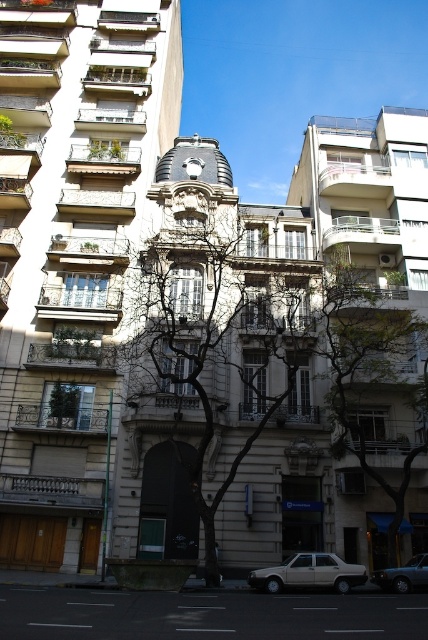
You are a delivery person who needs to park your beige matte sedan at lower center and a silver metallic sedan at center in a parking lot with limited space. Which car should you park first to maximize space efficiency?

The beige matte sedan at lower center is larger in size than the silver metallic sedan at center. To maximize space efficiency, you should park the larger beige matte sedan at lower center first, then the smaller silver metallic sedan at center.

You are standing at the entrance of the large ornate building and want to hail a beige matte sedan at lower center. Which direction should you walk to reach it?

The beige matte sedan at lower center is located at point (x=309, y=573), so you should walk towards the lower center direction to reach it.

You are standing on the street looking at the large ornate building. There are two points marked on the building facade. One is at coordinate point (210, 580) and the other at point (427, 564). Which point is closer to you?

Point (210, 580) is closer to you because it is further to the viewer than point (427, 564).